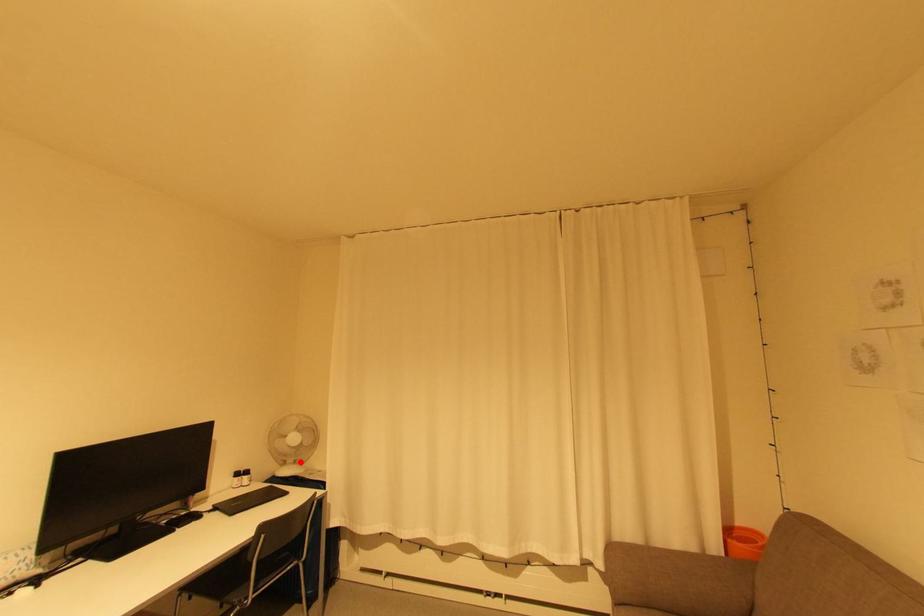
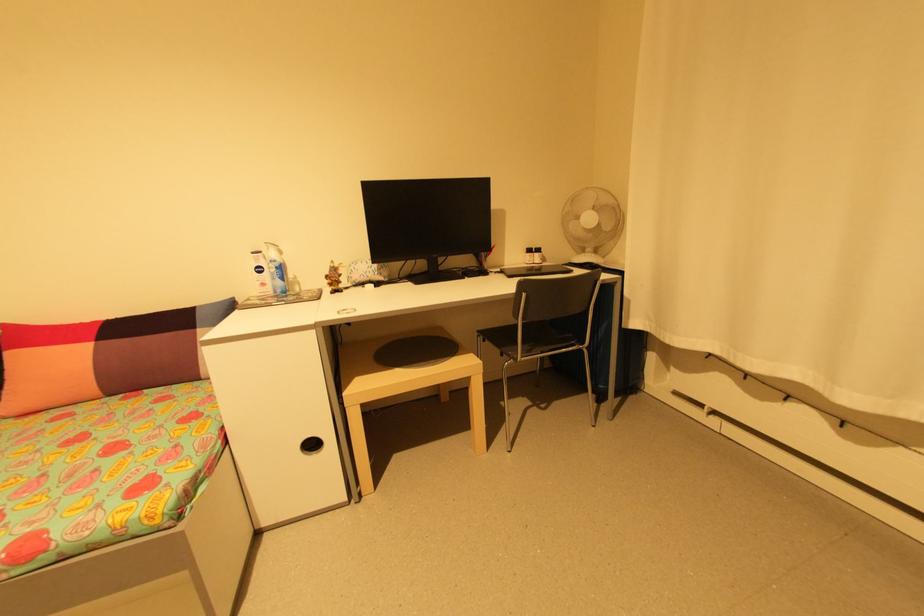
Find the pixel in the second image that matches the highlighted location in the first image.

(600, 252)